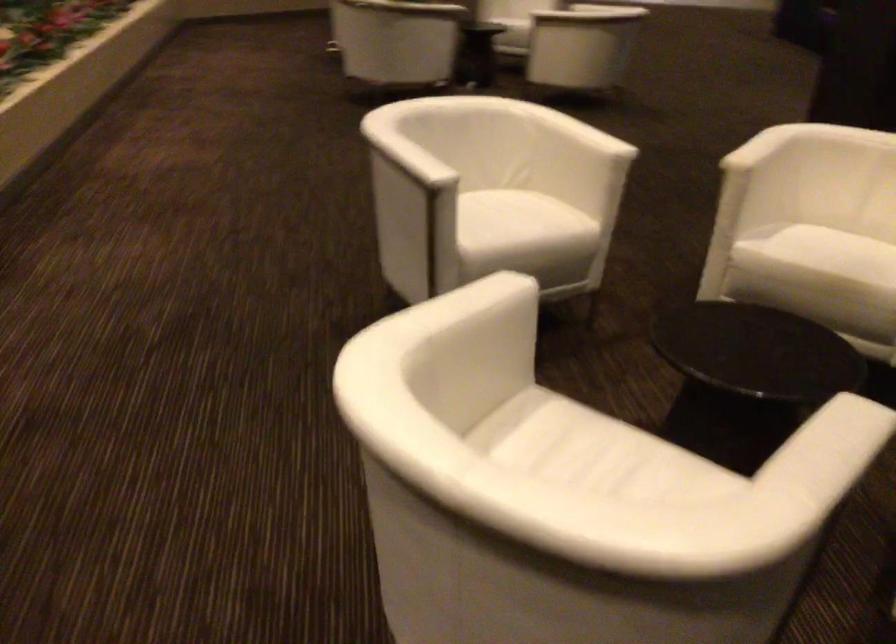
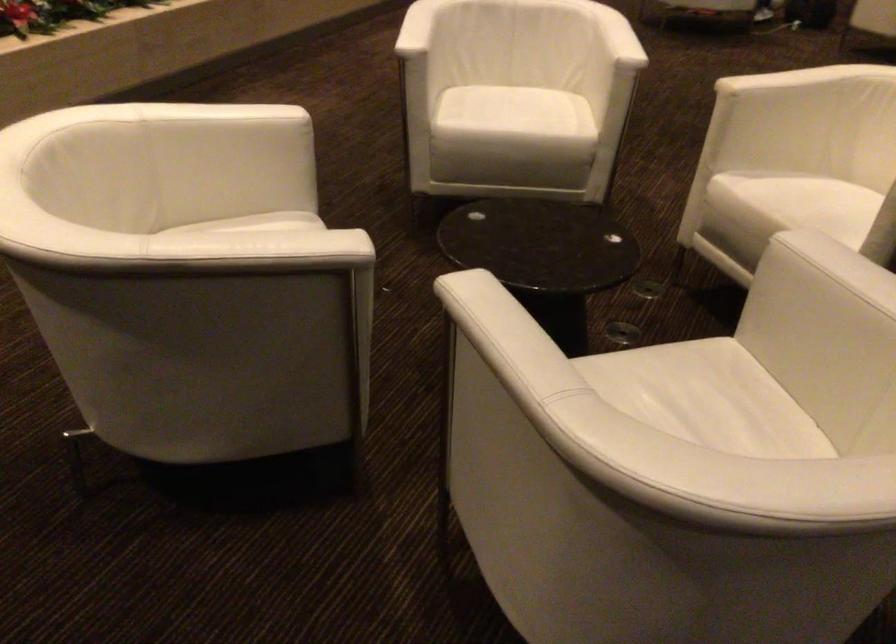
In the second image, find the point that corresponds to point 424,156 in the first image.

(417, 28)